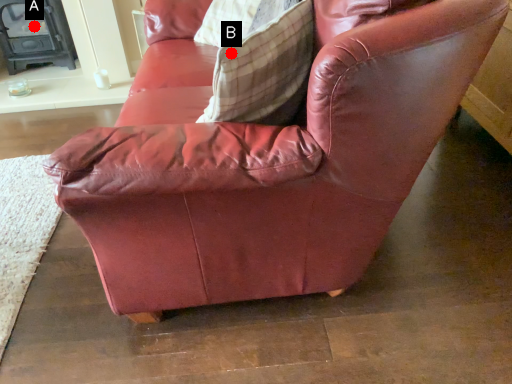
Question: Two points are circled on the image, labeled by A and B beside each circle. Which point is farther from the camera taking this photo?

Choices:
 (A) A is further
 (B) B is further

Answer: (A)